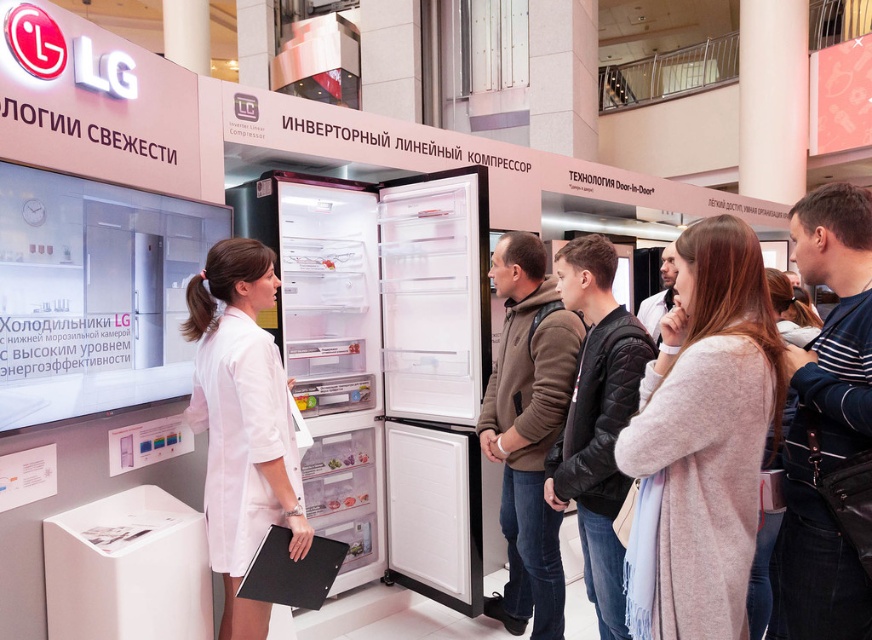
Question: Does light beige sweater at center right have a smaller size compared to white matte uniform at center?

Choices:
 (A) yes
 (B) no

Answer: (A)

Question: Considering the real-world distances, which object is farthest from the white matte refrigerator at center?

Choices:
 (A) brown hoodie at center
 (B) black quilted jacket at center

Answer: (B)

Question: Which point is farther from the camera taking this photo?

Choices:
 (A) (869, 413)
 (B) (578, 500)
 (C) (543, 637)

Answer: (C)

Question: Which point is farther to the camera?

Choices:
 (A) dark blue striped shirt at center right
 (B) black quilted jacket at center
 (C) brown hoodie at center
 (D) white matte uniform at center

Answer: (C)

Question: Observing the image, what is the correct spatial positioning of white matte refrigerator at center in reference to dark blue striped shirt at center right?

Choices:
 (A) left
 (B) right

Answer: (A)

Question: Does white matte refrigerator at center have a greater width compared to light beige sweater at center right?

Choices:
 (A) no
 (B) yes

Answer: (B)